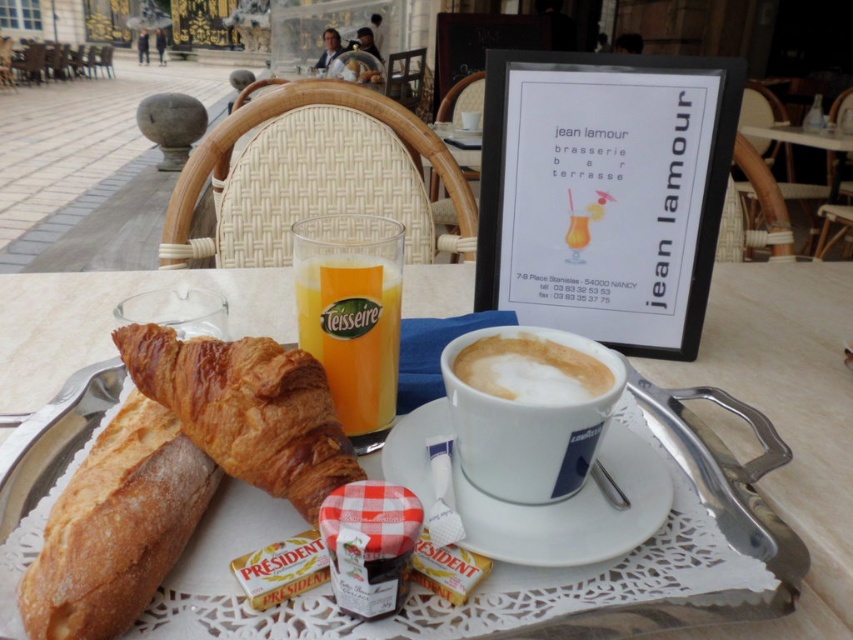
Question: Which object appears farthest from the camera in this image?

Choices:
 (A) golden brown flaky croissant at lower left
 (B) golden brown flaky croissant at center
 (C) white porcelain tray at center

Answer: (B)

Question: Considering the relative positions of golden brown flaky croissant at center and orangematte glass at center in the image provided, where is golden brown flaky croissant at center located with respect to orangematte glass at center?

Choices:
 (A) above
 (B) below

Answer: (B)

Question: Can you confirm if golden brown flaky croissant at center is smaller than white frothy coffee cup at center?

Choices:
 (A) no
 (B) yes

Answer: (A)

Question: Is golden brown flaky croissant at center thinner than white frothy coffee cup at center?

Choices:
 (A) no
 (B) yes

Answer: (A)

Question: Considering the real-world distances, which object is closest to the golden brown flaky croissant at center?

Choices:
 (A) white frothy coffee cup at center
 (B) white ceramic saucer at center
 (C) orangematte glass at center

Answer: (C)

Question: Based on their relative distances, which object is nearer to the white matte cup at center?

Choices:
 (A) golden brown flaky croissant at center
 (B) white ceramic saucer at center

Answer: (B)